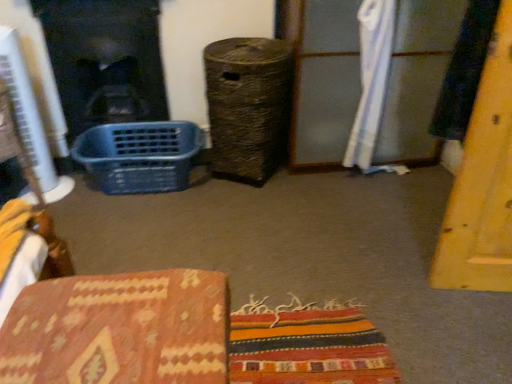
Question: Does blue plastic basket at left appear on the right side of white fabric curtain at upper right?

Choices:
 (A) yes
 (B) no

Answer: (B)

Question: Is blue plastic basket at left turned away from white fabric curtain at upper right?

Choices:
 (A) no
 (B) yes

Answer: (A)

Question: From the image's perspective, is blue plastic basket at left beneath white fabric curtain at upper right?

Choices:
 (A) yes
 (B) no

Answer: (A)

Question: Does blue plastic basket at left appear on the left side of white fabric curtain at upper right?

Choices:
 (A) no
 (B) yes

Answer: (B)

Question: Is blue plastic basket at left aimed at white fabric curtain at upper right?

Choices:
 (A) no
 (B) yes

Answer: (A)

Question: Is white fabric curtain at upper right located within blue plastic basket at left?

Choices:
 (A) yes
 (B) no

Answer: (B)

Question: Is blue plastic basket at left at the back of black glass fireplace at left?

Choices:
 (A) no
 (B) yes

Answer: (A)

Question: Is black glass fireplace at left further to the viewer compared to blue plastic basket at left?

Choices:
 (A) yes
 (B) no

Answer: (A)

Question: From a real-world perspective, is black glass fireplace at left beneath blue plastic basket at left?

Choices:
 (A) no
 (B) yes

Answer: (A)

Question: Does black glass fireplace at left appear on the left side of blue plastic basket at left?

Choices:
 (A) no
 (B) yes

Answer: (B)

Question: From the image's perspective, is black glass fireplace at left beneath blue plastic basket at left?

Choices:
 (A) yes
 (B) no

Answer: (B)

Question: Is the depth of black glass fireplace at left less than that of blue plastic basket at left?

Choices:
 (A) no
 (B) yes

Answer: (A)

Question: Is blue plastic basket at left behind black glass fireplace at left?

Choices:
 (A) yes
 (B) no

Answer: (B)